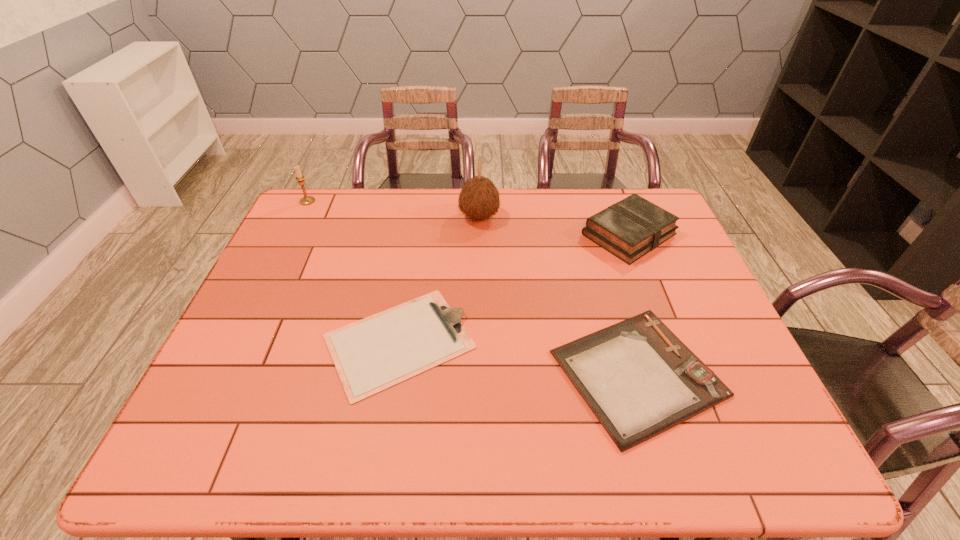
I want to click on free spot between the left clipboard and the candle holder, so click(353, 271).

At what (x,y) coordinates should I click in order to perform the action: click on vacant space that is in between the third tallest object and the tallest object. Please return your answer as a coordinate pair (x, y). Looking at the image, I should click on (554, 226).

You are a GUI agent. You are given a task and a screenshot of the screen. Output one action in this format:
    pyautogui.click(x=<x>, y=<y>)
    Task: Click on the unoccupied position between the tallest object and the leftmost object
    
    Given the screenshot: What is the action you would take?
    pyautogui.click(x=394, y=209)

Locate an element on the screen. The image size is (960, 540). free space between the right clipboard and the book is located at coordinates (633, 303).

The height and width of the screenshot is (540, 960). I want to click on empty space between the left clipboard and the third tallest object, so click(514, 288).

Identify which object is the second closest to the left clipboard. Please provide its 2D coordinates. Your answer should be formatted as a tuple, i.e. [(x, y)], where the tuple contains the x and y coordinates of a point satisfying the conditions above.

[(479, 198)]

Where is `the third closest object to the third tallest object`? Image resolution: width=960 pixels, height=540 pixels. the third closest object to the third tallest object is located at coordinates (373, 354).

Locate an element on the screen. This screenshot has height=540, width=960. vacant space that satisfies the following two spatial constraints: 1. on the surface of the coconut; 2. on the front side of the left clipboard is located at coordinates (479, 341).

What are the coordinates of `vacant space that satisfies the following two spatial constraints: 1. on the surface of the right clipboard; 2. on the left side of the coconut` in the screenshot? It's located at (479, 373).

At what (x,y) coordinates should I click in order to perform the action: click on blank area in the image that satisfies the following two spatial constraints: 1. on the surface of the right clipboard; 2. on the left side of the tallest object. Please return your answer as a coordinate pair (x, y). Image resolution: width=960 pixels, height=540 pixels. Looking at the image, I should click on (479, 373).